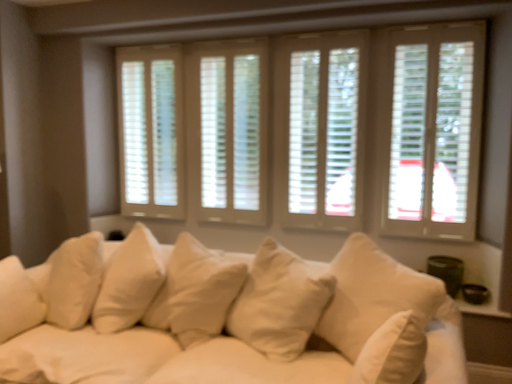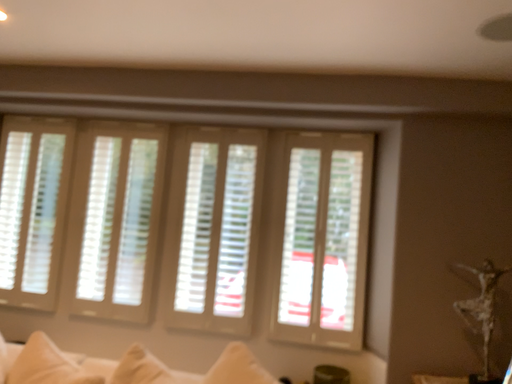
Question: How did the camera likely rotate when shooting the video?

Choices:
 (A) rotated upward
 (B) rotated downward

Answer: (A)